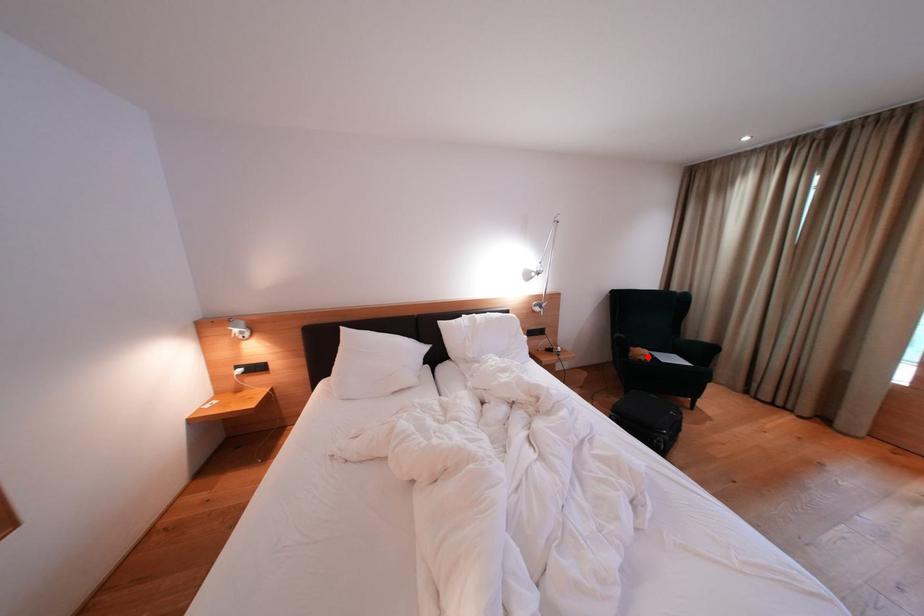
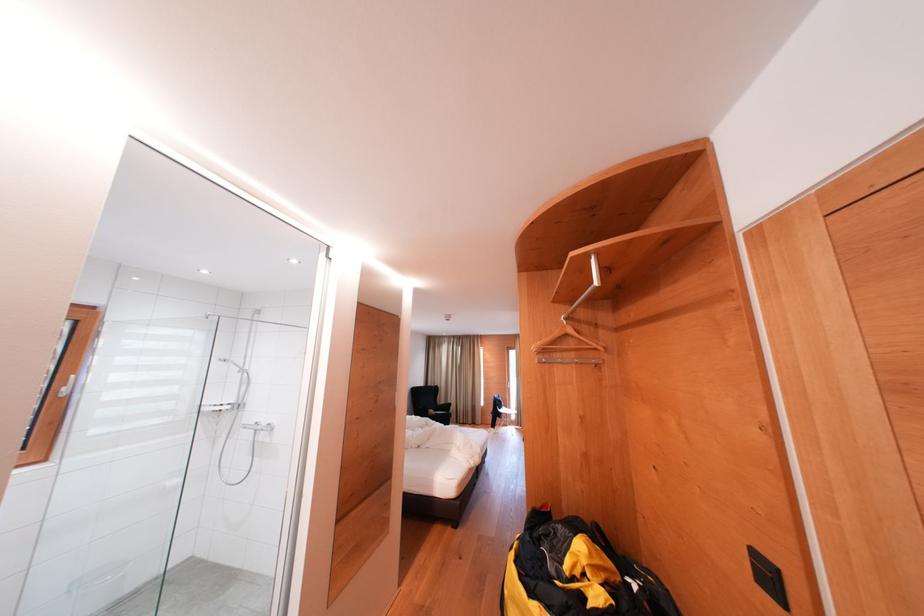
Question: I am providing you with two images of the same scene from different viewpoints. In image1, a red point is highlighted. Considering the same 3D point in image2, which of the following is correct?

Choices:
 (A) It is closer
 (B) It is farther

Answer: (B)